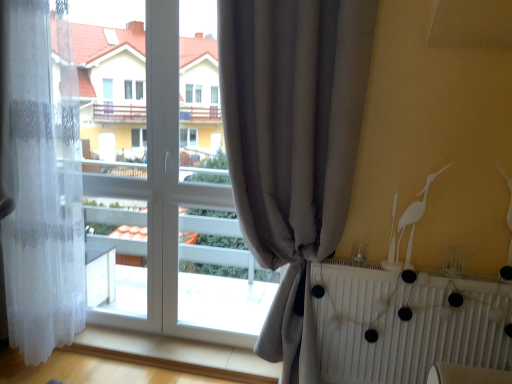
Locate an element on the screen. The width and height of the screenshot is (512, 384). white matte bird at upper right is located at coordinates (412, 223).

What do you see at coordinates (40, 183) in the screenshot? The image size is (512, 384). I see `white lace curtain at left, arranged as the 2th curtain when viewed from the right` at bounding box center [40, 183].

I want to click on white matte radiator at lower right, so click(406, 324).

What are the coordinates of `gray fabric curtain at center, marked as the second curtain in a left-to-right arrangement` in the screenshot? It's located at (293, 145).

Which object is positioned more to the right, white lace curtain at left, arranged as the 2th curtain when viewed from the right, or gray fabric curtain at center, which ranks as the 1th curtain in right-to-left order?

From the viewer's perspective, gray fabric curtain at center, which ranks as the 1th curtain in right-to-left order, appears more on the right side.

Considering the relative sizes of white lace curtain at left, arranged as the 2th curtain when viewed from the right, and gray fabric curtain at center, marked as the second curtain in a left-to-right arrangement, in the image provided, is white lace curtain at left, arranged as the 2th curtain when viewed from the right, bigger than gray fabric curtain at center, marked as the second curtain in a left-to-right arrangement,?

Correct, white lace curtain at left, arranged as the 2th curtain when viewed from the right, is larger in size than gray fabric curtain at center, marked as the second curtain in a left-to-right arrangement.

Is point (64, 163) closer or farther from the camera than point (234, 40)?

Point (64, 163) is positioned farther from the camera compared to point (234, 40).

Is gray fabric curtain at center, marked as the second curtain in a left-to-right arrangement, positioned before white matte radiator at lower right?

Yes, the depth of gray fabric curtain at center, marked as the second curtain in a left-to-right arrangement, is less than that of white matte radiator at lower right.

In the scene shown: Considering the sizes of objects gray fabric curtain at center, marked as the second curtain in a left-to-right arrangement, and white matte radiator at lower right in the image provided, who is bigger, gray fabric curtain at center, marked as the second curtain in a left-to-right arrangement, or white matte radiator at lower right?

gray fabric curtain at center, marked as the second curtain in a left-to-right arrangement, is bigger.

Is gray fabric curtain at center, marked as the second curtain in a left-to-right arrangement, inside the boundaries of white matte radiator at lower right, or outside?

gray fabric curtain at center, marked as the second curtain in a left-to-right arrangement, is spatially situated outside white matte radiator at lower right.

Considering the sizes of objects gray fabric curtain at center, which ranks as the 1th curtain in right-to-left order, and white matte radiator at lower right in the image provided, who is thinner, gray fabric curtain at center, which ranks as the 1th curtain in right-to-left order, or white matte radiator at lower right?

white matte radiator at lower right is thinner.

Does white lace curtain at left, the 1th curtain viewed from the left, come behind white matte bird at upper right?

No, white lace curtain at left, the 1th curtain viewed from the left, is closer to the viewer.

Which is more to the left, white lace curtain at left, the 1th curtain viewed from the left, or white matte bird at upper right?

white lace curtain at left, the 1th curtain viewed from the left.

Can you tell me how much white lace curtain at left, the 1th curtain viewed from the left, and white matte bird at upper right differ in facing direction?

2.94 degrees separate the facing orientations of white lace curtain at left, the 1th curtain viewed from the left, and white matte bird at upper right.

From the image's perspective, between white matte bird at upper right and gray fabric curtain at center, marked as the second curtain in a left-to-right arrangement, which one is located above?

white matte bird at upper right, from the image's perspective.

Based on the photo, how much distance is there between white matte bird at upper right and gray fabric curtain at center, which ranks as the 1th curtain in right-to-left order?

white matte bird at upper right and gray fabric curtain at center, which ranks as the 1th curtain in right-to-left order, are 24.11 inches apart.

Is white matte bird at upper right positioned beyond the bounds of gray fabric curtain at center, which ranks as the 1th curtain in right-to-left order?

Yes, white matte bird at upper right is located beyond the bounds of gray fabric curtain at center, which ranks as the 1th curtain in right-to-left order.

Which object is positioned more to the left, white matte bird at upper right or gray fabric curtain at center, marked as the second curtain in a left-to-right arrangement?

From the viewer's perspective, gray fabric curtain at center, marked as the second curtain in a left-to-right arrangement, appears more on the left side.

Which of these two, gray fabric curtain at center, marked as the second curtain in a left-to-right arrangement, or white matte bird at upper right, stands taller?

gray fabric curtain at center, marked as the second curtain in a left-to-right arrangement, is taller.

From a real-world perspective, is gray fabric curtain at center, marked as the second curtain in a left-to-right arrangement, physically below white matte bird at upper right?

Correct, in the physical world, gray fabric curtain at center, marked as the second curtain in a left-to-right arrangement, is lower than white matte bird at upper right.

Considering the relative sizes of gray fabric curtain at center, marked as the second curtain in a left-to-right arrangement, and white matte bird at upper right in the image provided, is gray fabric curtain at center, marked as the second curtain in a left-to-right arrangement, bigger than white matte bird at upper right?

Correct, gray fabric curtain at center, marked as the second curtain in a left-to-right arrangement, is larger in size than white matte bird at upper right.

How much distance is there between gray fabric curtain at center, which ranks as the 1th curtain in right-to-left order, and white matte bird at upper right?

They are 24.11 inches apart.

Which is more to the right, white matte radiator at lower right or white matte bird at upper right?

Positioned to the right is white matte radiator at lower right.

From the image's perspective, is white matte radiator at lower right on top of white matte bird at upper right?

Actually, white matte radiator at lower right appears below white matte bird at upper right in the image.

How different are the orientations of white matte radiator at lower right and white matte bird at upper right in degrees?

They differ by 0.0016 degrees in their facing directions.

Does white matte radiator at lower right have a smaller size compared to white matte bird at upper right?

Actually, white matte radiator at lower right might be larger than white matte bird at upper right.

From the picture: How different are the orientations of white matte bird at upper right and white matte radiator at lower right in degrees?

0.0016 degrees separate the facing orientations of white matte bird at upper right and white matte radiator at lower right.

Which is nearer, (411, 212) or (341, 380)?

The point (411, 212) is in front.

In the image, there is a white matte radiator at lower right. At what (x,y) coordinates should I click in order to perform the action: click on bird above it (from the image's perspective). Please return your answer as a coordinate pair (x, y). Looking at the image, I should click on [412, 223].

The image size is (512, 384). Identify the location of curtain above the gray fabric curtain at center, marked as the second curtain in a left-to-right arrangement (from the image's perspective). (40, 183).

Locate an element on the screen. radiator behind the gray fabric curtain at center, which ranks as the 1th curtain in right-to-left order is located at coordinates (406, 324).

Based on their spatial positions, is white matte bird at upper right or white matte radiator at lower right further from gray fabric curtain at center, marked as the second curtain in a left-to-right arrangement?

white matte bird at upper right.

Based on their spatial positions, is white matte radiator at lower right or gray fabric curtain at center, marked as the second curtain in a left-to-right arrangement, closer to white matte bird at upper right?

white matte radiator at lower right lies closer to white matte bird at upper right than the other object.

Based on their spatial positions, is white matte bird at upper right or white matte radiator at lower right closer to white lace curtain at left, the 1th curtain viewed from the left?

The object closer to white lace curtain at left, the 1th curtain viewed from the left, is white matte radiator at lower right.

Considering their positions, is gray fabric curtain at center, marked as the second curtain in a left-to-right arrangement, positioned further to white matte radiator at lower right than white lace curtain at left, arranged as the 2th curtain when viewed from the right?

Among the two, white lace curtain at left, arranged as the 2th curtain when viewed from the right, is located further to white matte radiator at lower right.

Based on their spatial positions, is white lace curtain at left, arranged as the 2th curtain when viewed from the right, or white matte radiator at lower right closer to white matte bird at upper right?

white matte radiator at lower right lies closer to white matte bird at upper right than the other object.

Based on their spatial positions, is white matte radiator at lower right or white lace curtain at left, the 1th curtain viewed from the left, further from white matte bird at upper right?

Among the two, white lace curtain at left, the 1th curtain viewed from the left, is located further to white matte bird at upper right.

Considering their positions, is white matte bird at upper right positioned closer to white matte radiator at lower right than white lace curtain at left, arranged as the 2th curtain when viewed from the right?

white matte bird at upper right is positioned closer to the anchor white matte radiator at lower right.

When comparing their distances from gray fabric curtain at center, marked as the second curtain in a left-to-right arrangement, does white matte bird at upper right or white lace curtain at left, the 1th curtain viewed from the left, seem further?

white lace curtain at left, the 1th curtain viewed from the left.

Locate an element on the screen. This screenshot has width=512, height=384. curtain between white lace curtain at left, the 1th curtain viewed from the left, and white matte bird at upper right from left to right is located at coordinates (293, 145).

Where is `curtain located between white lace curtain at left, arranged as the 2th curtain when viewed from the right, and white matte radiator at lower right in the left-right direction`? The width and height of the screenshot is (512, 384). curtain located between white lace curtain at left, arranged as the 2th curtain when viewed from the right, and white matte radiator at lower right in the left-right direction is located at coordinates [x=293, y=145].

I want to click on bird located between white lace curtain at left, the 1th curtain viewed from the left, and white matte radiator at lower right in the left-right direction, so [x=412, y=223].

Find the location of a particular element. This screenshot has width=512, height=384. bird between gray fabric curtain at center, marked as the second curtain in a left-to-right arrangement, and white matte radiator at lower right is located at coordinates (412, 223).